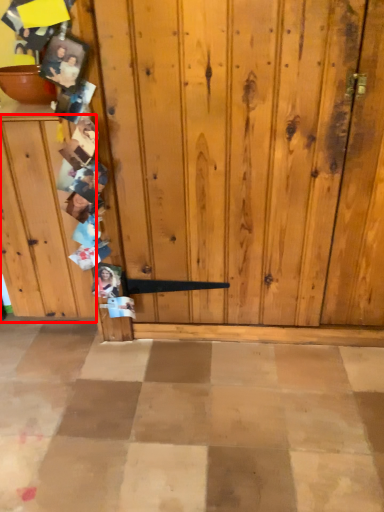
Question: Where is dresser (annotated by the red box) located in relation to bowl in the image?

Choices:
 (A) left
 (B) right

Answer: (B)